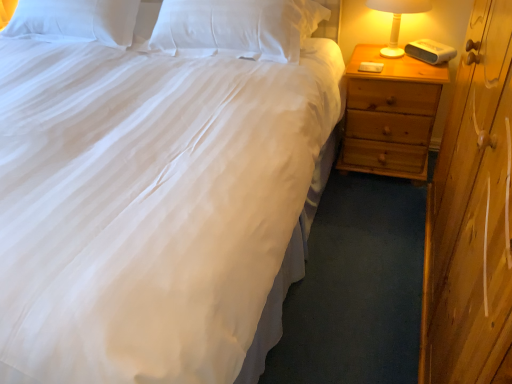
Question: From their relative heights in the image, would you say white soft pillow at upper center, the 2th pillow in the left-to-right sequence, is taller or shorter than white plastic lamp at right?

Choices:
 (A) tall
 (B) short

Answer: (B)

Question: From a real-world perspective, is white soft pillow at upper center, which is the 1th pillow in right-to-left order, above or below white plastic lamp at right?

Choices:
 (A) below
 (B) above

Answer: (B)

Question: Which object is positioned closest to the white soft pillow at upper left, acting as the 1th pillow starting from the left?

Choices:
 (A) white soft pillow at upper center, the 2th pillow in the left-to-right sequence
 (B) white plastic lamp at right
 (C) light brown wood nightstand at right

Answer: (A)

Question: Based on their relative distances, which object is nearer to the light brown wood nightstand at right?

Choices:
 (A) white soft pillow at upper left, the second pillow from the right
 (B) white soft pillow at upper center, which is the 1th pillow in right-to-left order
 (C) white plastic lamp at right

Answer: (C)